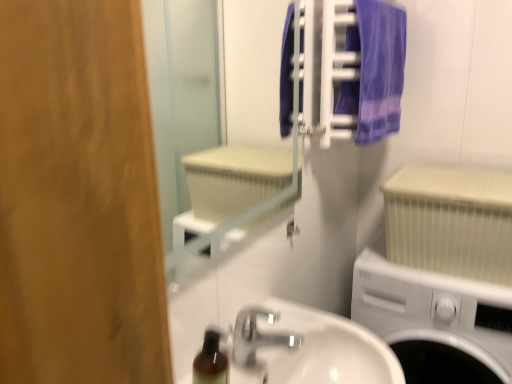
Question: Would you say silver metallic faucet at lower center is to the left or to the right of white glossy sink at center in the picture?

Choices:
 (A) right
 (B) left

Answer: (B)

Question: Is silver metallic faucet at lower center wider or thinner than white glossy sink at center?

Choices:
 (A) wide
 (B) thin

Answer: (B)

Question: Based on their relative distances, which object is farther from the silver metallic faucet at lower center?

Choices:
 (A) white plastic washing machine at lower right
 (B) purple fabric towel at upper right
 (C) white textured radiator at right
 (D) purple fabric towel at upper right
 (E) white textured mirror at upper center

Answer: (E)

Question: Which object is positioned closest to the white glossy sink at center?

Choices:
 (A) white textured radiator at right
 (B) white textured mirror at upper center
 (C) purple fabric towel at upper right
 (D) silver metallic faucet at lower center
 (E) white plastic washing machine at lower right

Answer: (D)